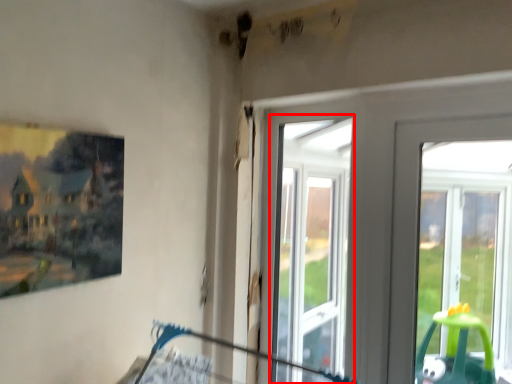
Question: From the image's perspective, what is the correct spatial relationship of bay window (annotated by the red box) in relation to picture frame?

Choices:
 (A) below
 (B) above

Answer: (A)